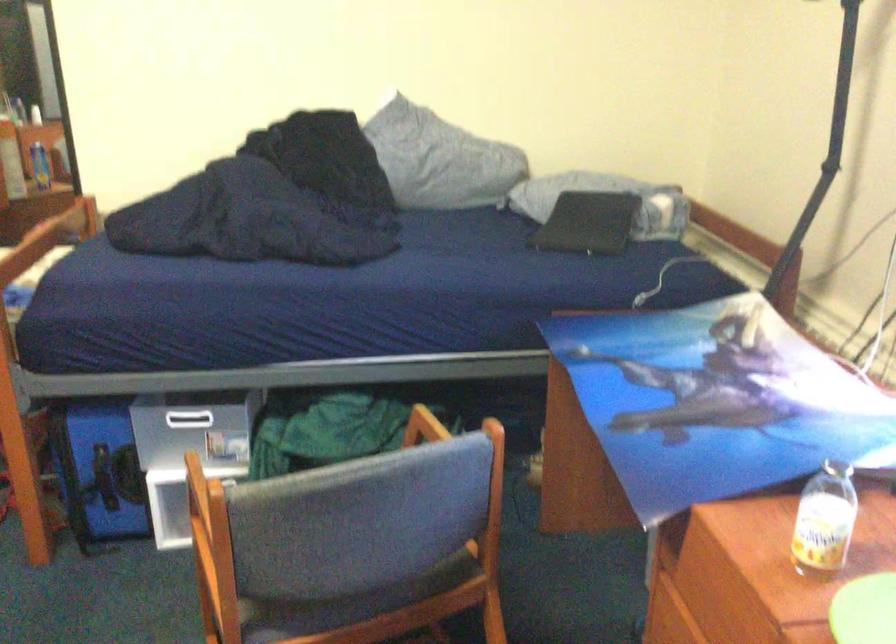
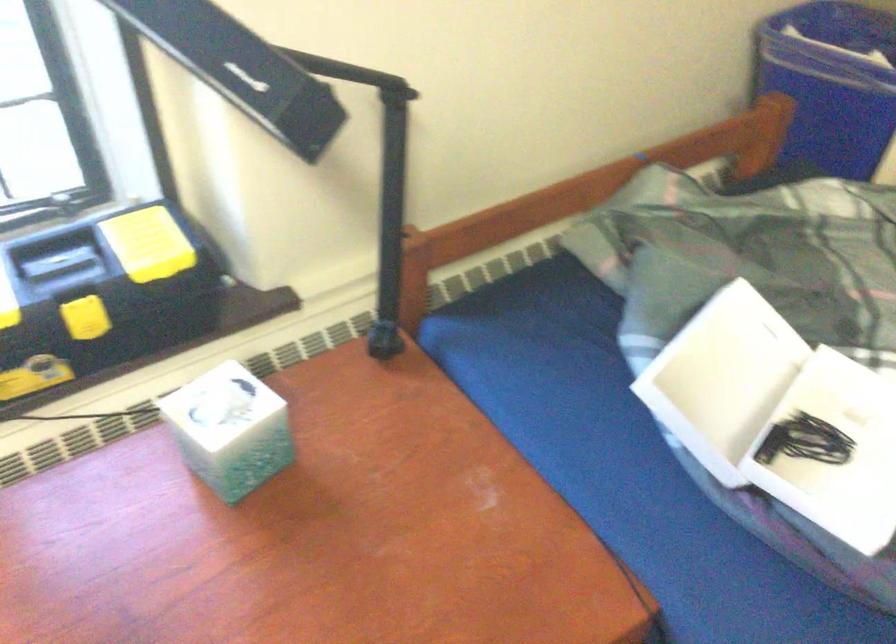
The images are taken continuously from a first-person perspective. In which direction is your viewpoint rotating?

The rotation direction of the camera is right-down.